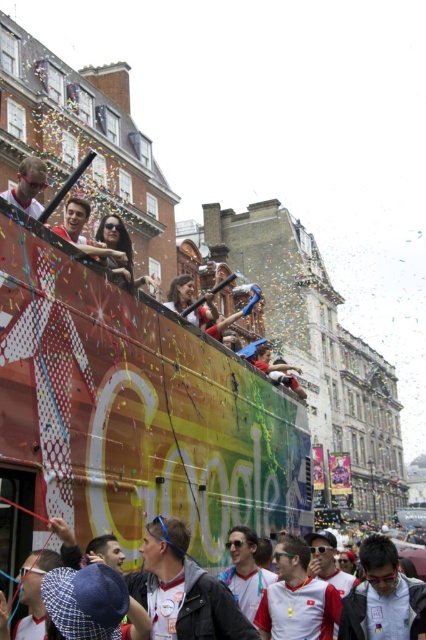
You are a photographer standing in the crowd at the celebratory event. You want to take a photo of the matte red shirt at center and the matte black sunglasses at center. Based on their positions, will the sunglasses appear above or below the shirt in the photo?

The matte black sunglasses at center is located below the matte red shirt at center, so in the photo, the sunglasses will appear below the shirt.

You are standing on the street and want to locate the matte black sunglasses at center. What are the coordinates where you should look?

The coordinates to locate the matte black sunglasses at center are at point (x=382, y=596).

You are a photographer standing at the front of the street. You want to take a photo of both the white fabric shirt at center and the matte white shirt at upper left. Which shirt will appear larger in your photo?

The white fabric shirt at center will appear larger in the photo because it is closer to the viewer than the matte white shirt at upper left.